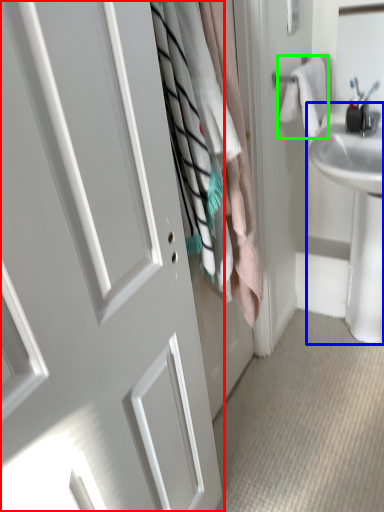
Question: Based on their relative distances, which object is nearer to door (highlighted by a red box)? Choose from sink (highlighted by a blue box) and bath towel (highlighted by a green box).

Choices:
 (A) sink
 (B) bath towel

Answer: (B)